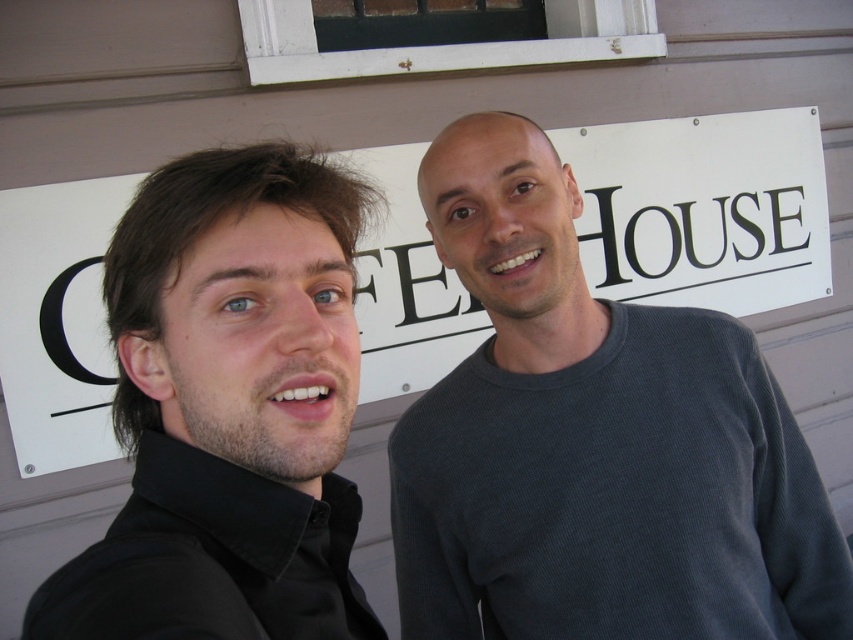
Question: Is gray ribbed sweater at center smaller than white paper sign at center?

Choices:
 (A) yes
 (B) no

Answer: (A)

Question: Is black matte shirt at left bigger than white paper sign at center?

Choices:
 (A) no
 (B) yes

Answer: (A)

Question: Which point is closer to the camera?

Choices:
 (A) (451, 275)
 (B) (512, 240)

Answer: (B)

Question: Does black matte shirt at left have a smaller size compared to white paper sign at center?

Choices:
 (A) no
 (B) yes

Answer: (B)

Question: Estimate the real-world distances between objects in this image. Which object is farther from the gray ribbed sweater at center?

Choices:
 (A) black matte shirt at left
 (B) white paper sign at center

Answer: (B)

Question: Which point is closer to the camera?

Choices:
 (A) (279, 490)
 (B) (540, 525)

Answer: (A)